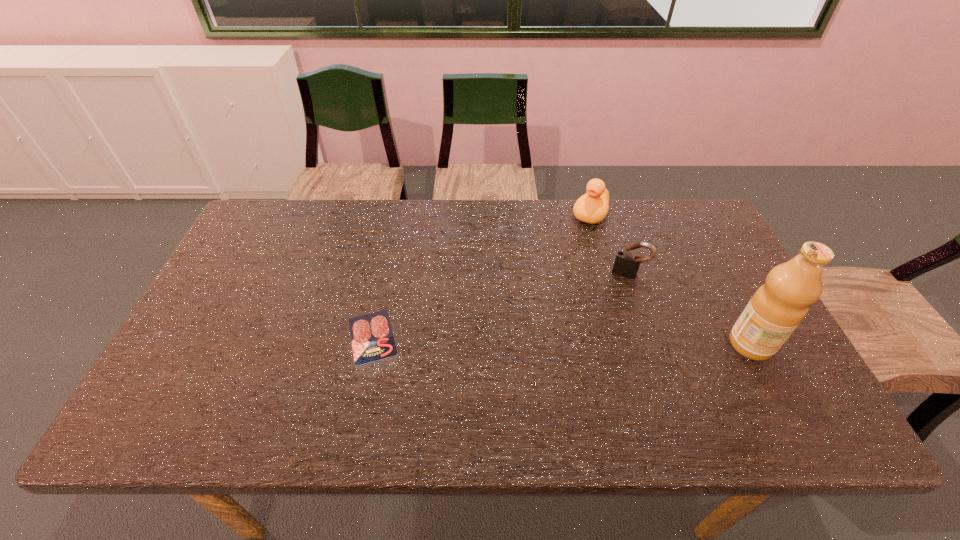
In the image, there is a desktop. Where is `vacant space at the far left corner`? The width and height of the screenshot is (960, 540). vacant space at the far left corner is located at coordinates (245, 233).

Where is `free location at the far right corner`? The width and height of the screenshot is (960, 540). free location at the far right corner is located at coordinates (713, 246).

At what (x,y) coordinates should I click in order to perform the action: click on blank region between the rightmost object and the farthest object. Please return your answer as a coordinate pair (x, y). The image size is (960, 540). Looking at the image, I should click on (670, 279).

The width and height of the screenshot is (960, 540). Identify the location of vacant point located between the salami and the third nearest object. (500, 305).

This screenshot has height=540, width=960. In order to click on vacant region between the second farthest object and the rightmost object in this screenshot , I will do `click(689, 309)`.

This screenshot has height=540, width=960. In order to click on vacant area that lies between the farthest object and the padlock in this screenshot , I will do `click(610, 244)`.

Where is `blank region between the rightmost object and the padlock`? blank region between the rightmost object and the padlock is located at coordinates (689, 309).

Image resolution: width=960 pixels, height=540 pixels. Find the location of `empty location between the third nearest object and the leftmost object`. empty location between the third nearest object and the leftmost object is located at coordinates (500, 305).

Find the location of a particular element. free spot between the rightmost object and the farthest object is located at coordinates (670, 279).

At what (x,y) coordinates should I click in order to perform the action: click on free area in between the olive oil and the leftmost object. Please return your answer as a coordinate pair (x, y). Looking at the image, I should click on (562, 340).